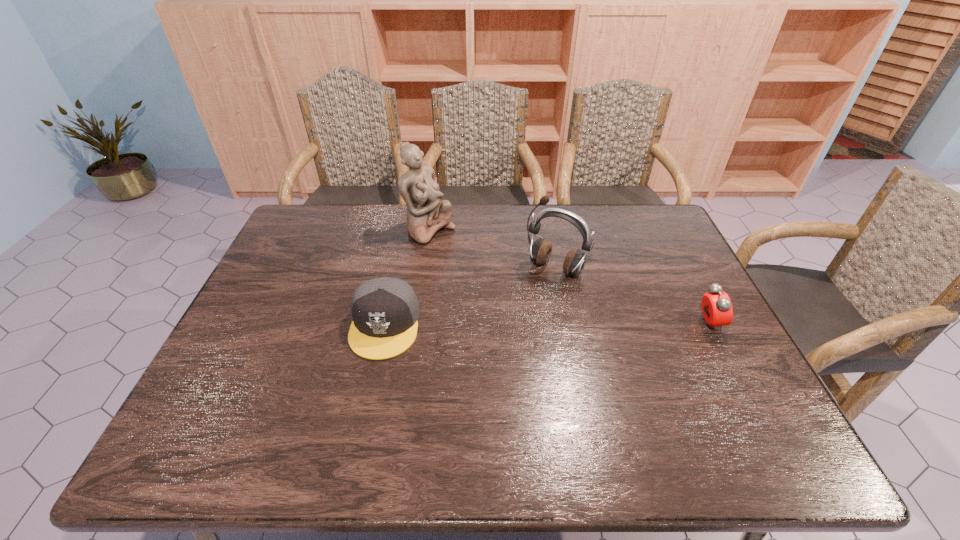
The height and width of the screenshot is (540, 960). I want to click on vacant space located 0.370m on the front-facing side of the tallest object, so click(x=532, y=301).

This screenshot has height=540, width=960. What are the coordinates of `free space located on the front-facing side of the tallest object` in the screenshot? It's located at (463, 254).

This screenshot has height=540, width=960. Identify the location of vacant space located on the front-facing side of the tallest object. (506, 284).

Identify the location of object that is positioned at the far edge. The height and width of the screenshot is (540, 960). (426, 213).

This screenshot has height=540, width=960. In order to click on object located at the right edge in this screenshot , I will do `click(717, 310)`.

This screenshot has width=960, height=540. Find the location of `free space at the far edge of the desktop`. free space at the far edge of the desktop is located at coordinates (496, 224).

Where is `vacant space at the near edge of the desktop`? vacant space at the near edge of the desktop is located at coordinates (554, 414).

In order to click on free space at the left edge in this screenshot , I will do `click(303, 284)`.

This screenshot has width=960, height=540. In the image, there is a desktop. Find the location of `vacant region at the right edge`. vacant region at the right edge is located at coordinates (686, 274).

Where is `blank space at the near left corner of the desktop`? Image resolution: width=960 pixels, height=540 pixels. blank space at the near left corner of the desktop is located at coordinates (254, 391).